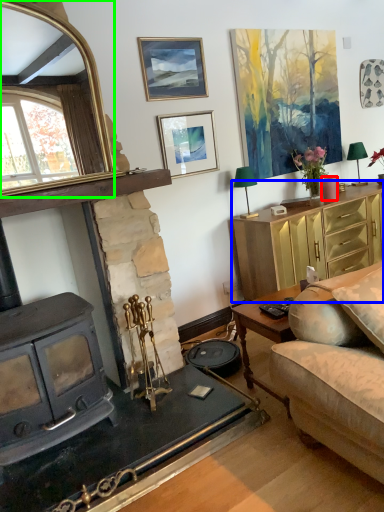
Question: Based on their relative distances, which object is farther from candle (highlighted by a red box)? Choose from cabinetry (highlighted by a blue box) and mirror (highlighted by a green box).

Choices:
 (A) cabinetry
 (B) mirror

Answer: (B)